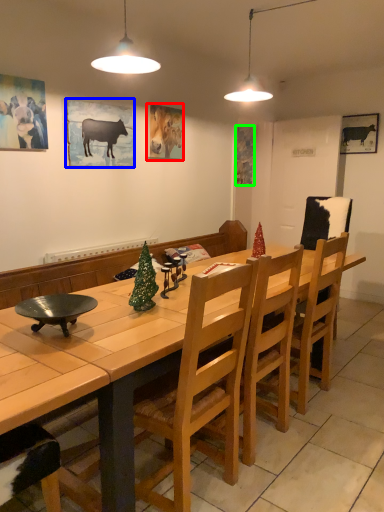
Question: Considering the real-world distances, which object is farthest from picture frame (highlighted by a red box)? picture frame (highlighted by a blue box) or picture frame (highlighted by a green box)?

Choices:
 (A) picture frame
 (B) picture frame

Answer: (B)